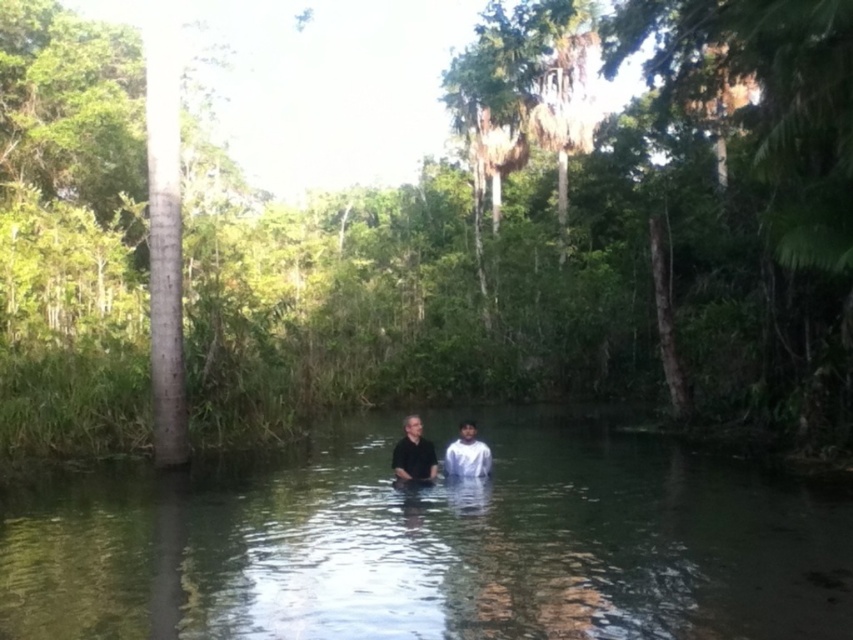
Between green leafy jungle at center and black matte shirt at center, which one is positioned higher?

green leafy jungle at center is above.

Does green leafy jungle at center appear under black matte shirt at center?

Actually, green leafy jungle at center is above black matte shirt at center.

Is point (207, 440) positioned behind point (425, 464)?

Yes, point (207, 440) is farther from viewer.

Locate an element on the screen. green leafy jungle at center is located at coordinates (566, 237).

Is point (694, 596) positioned behind point (480, 452)?

No, it is not.

Does clear water at center have a lesser height compared to white matte shirt at center?

Yes.

Is point (326, 532) farther from viewer compared to point (490, 465)?

No, (326, 532) is in front of (490, 465).

At what (x,y) coordinates should I click in order to perform the action: click on clear water at center. Please return your answer as a coordinate pair (x, y). The height and width of the screenshot is (640, 853). Looking at the image, I should click on (434, 544).

Who is shorter, clear water at center or black matte shirt at center?

With less height is clear water at center.

Who is taller, clear water at center or black matte shirt at center?

black matte shirt at center is taller.

From the picture: Who is more forward, (26, 499) or (405, 432)?

Point (405, 432)

Locate an element on the screen. clear water at center is located at coordinates (434, 544).